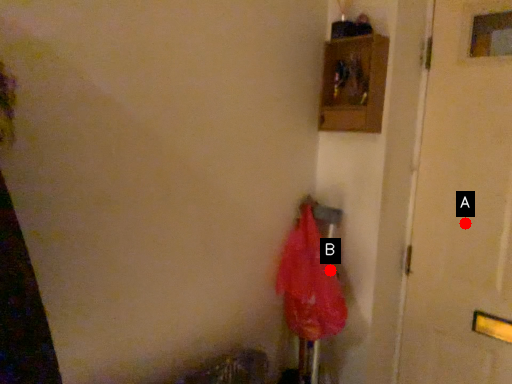
Question: Two points are circled on the image, labeled by A and B beside each circle. Which point is farther to the camera?

Choices:
 (A) A is further
 (B) B is further

Answer: (A)